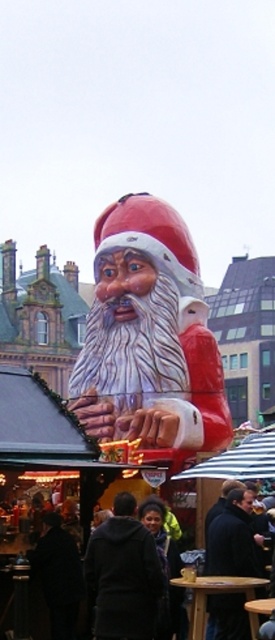
Question: Can you confirm if matte red santa claus at center is bigger than black matte jacket at center?

Choices:
 (A) yes
 (B) no

Answer: (A)

Question: Which of the following is the farthest from the observer?

Choices:
 (A) (147, 602)
 (B) (232, 525)
 (C) (117, 410)

Answer: (C)

Question: Does black matte jacket at center appear on the right side of dark brown leather jacket at center?

Choices:
 (A) no
 (B) yes

Answer: (A)

Question: Is black matte jacket at center below dark brown leather jacket at center?

Choices:
 (A) no
 (B) yes

Answer: (B)

Question: Which point is closer to the camera taking this photo?

Choices:
 (A) click(218, 545)
 (B) click(128, 636)

Answer: (B)

Question: Which object is closer to the camera taking this photo?

Choices:
 (A) dark brown leather jacket at center
 (B) black matte jacket at center

Answer: (B)